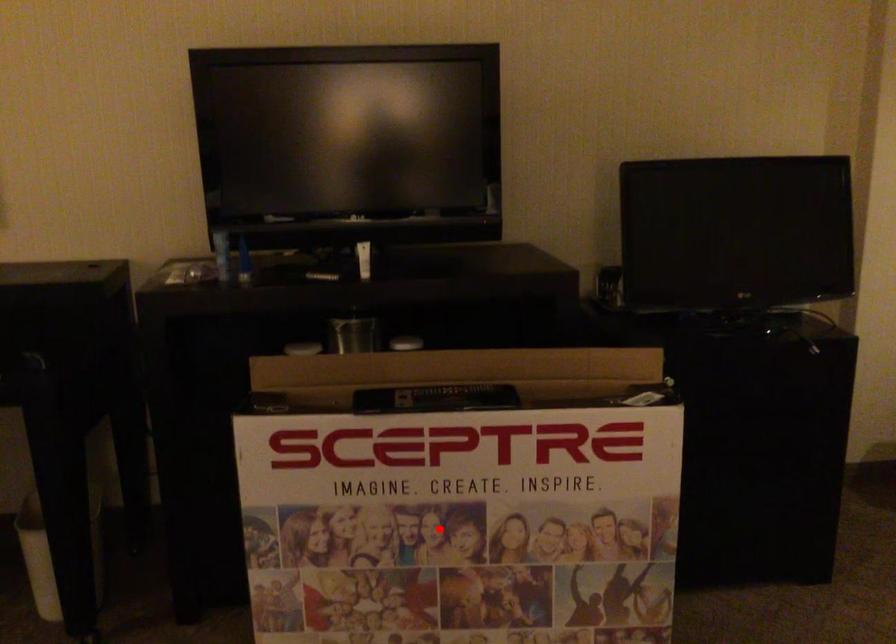
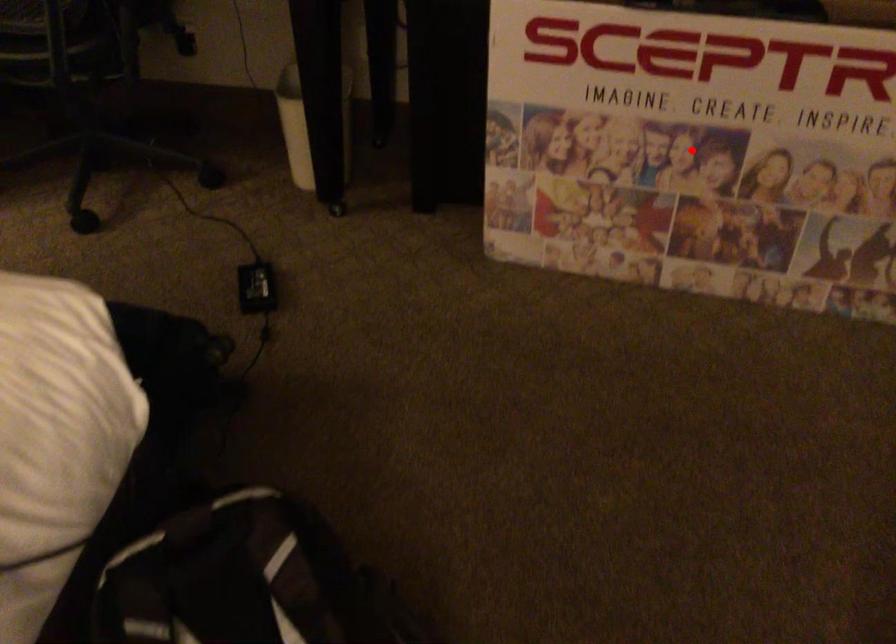
Based on the photo, I am providing you with two images of the same scene from different viewpoints. A red point is marked on the first image and another point is marked on the second image. Is the marked point in image1 the same physical position as the marked point in image2?

Yes